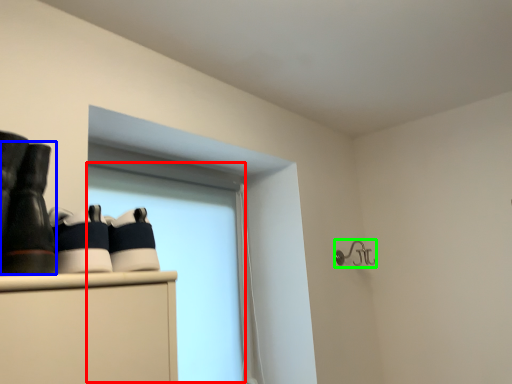
Question: Considering the real-world distances, which object is farthest from window screen (highlighted by a red box)? footwear (highlighted by a blue box) or shower (highlighted by a green box)?

Choices:
 (A) footwear
 (B) shower

Answer: (A)